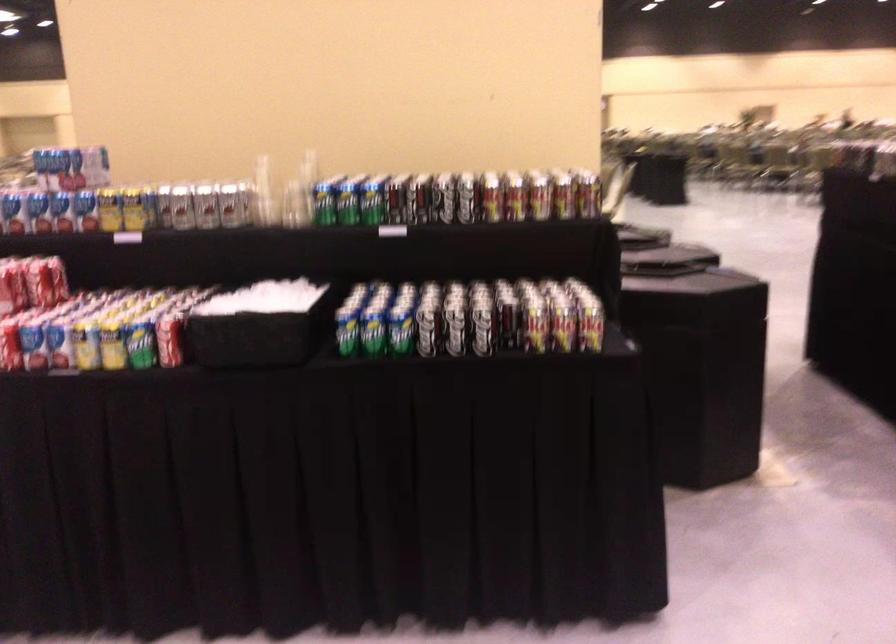
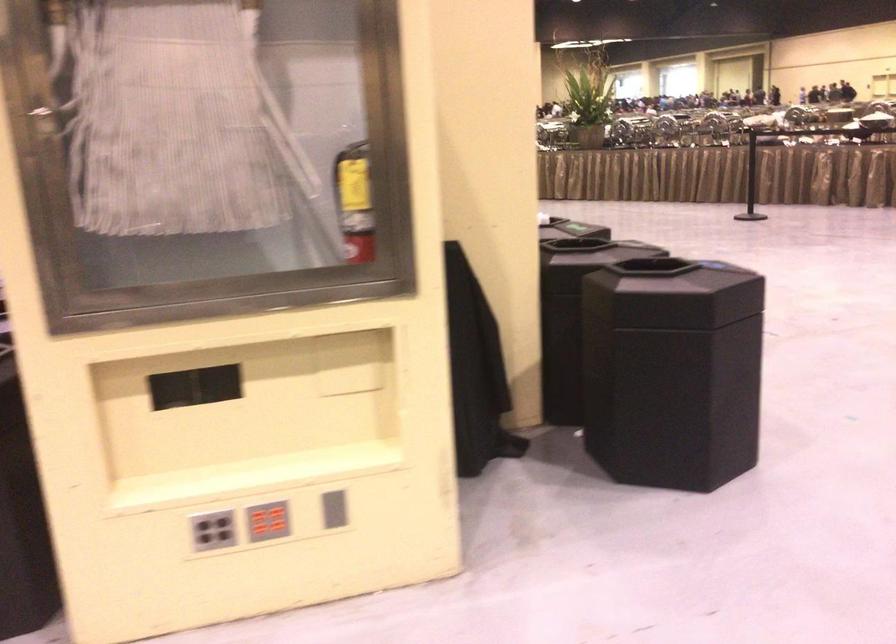
Question: I am providing you with two images of the same scene from different viewpoints. Which of the following objects are not visible in image2?

Choices:
 (A) small owl figurine
 (B) red button panel
 (C) grey button panel
 (D) yellow soda can

Answer: (D)